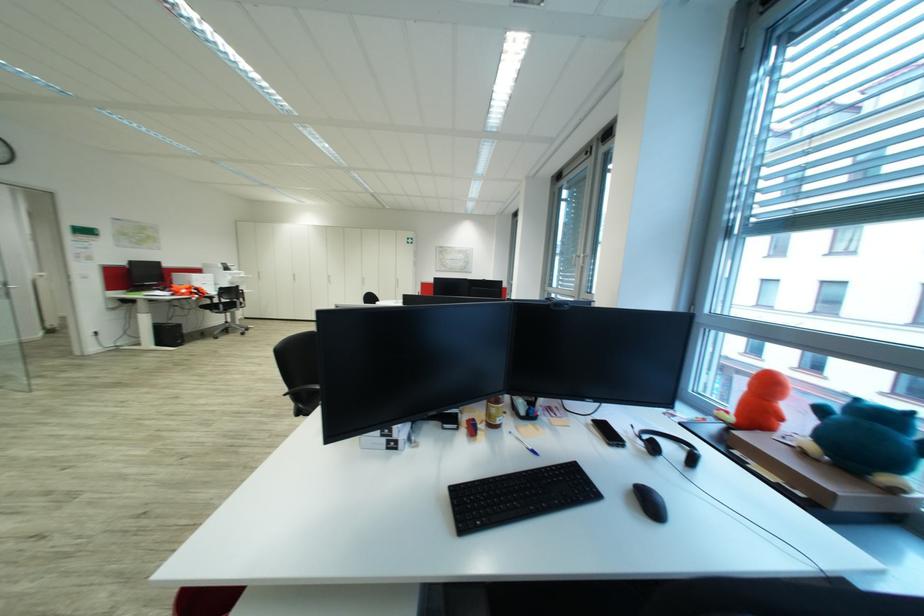
Find the location of a particular element. This screenshot has height=616, width=924. glass door handle is located at coordinates (8, 286).